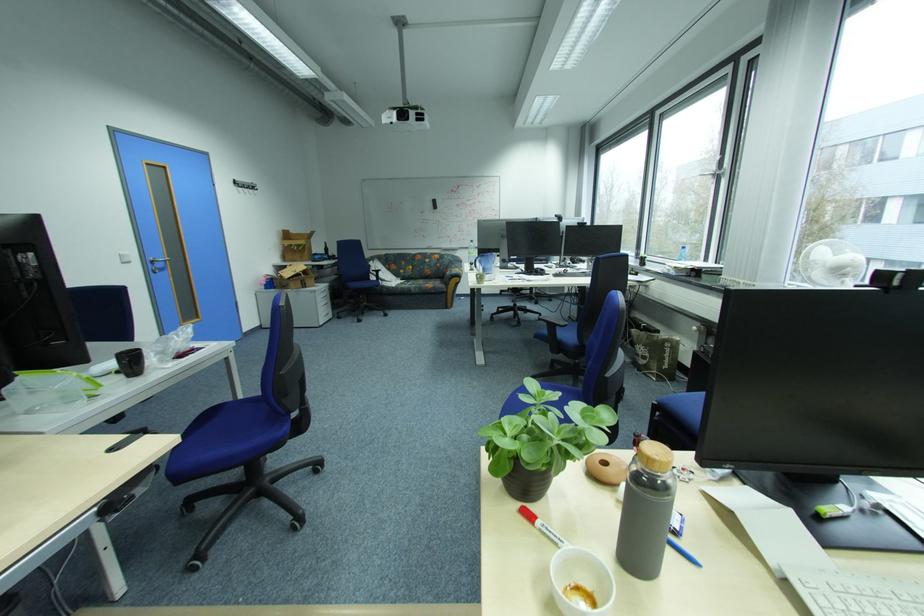
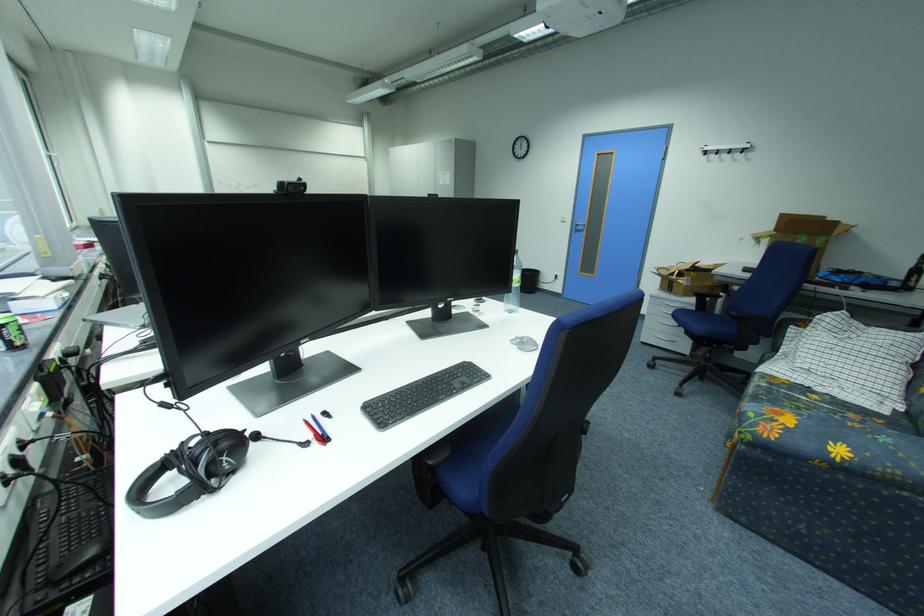
Question: I am providing you with two images of the same scene from different viewpoints. Please identify which objects are invisible in image2.

Choices:
 (A) green round pillow
 (B) blue pen
 (C) sofa sitting surface
 (D) wall hook

Answer: (B)